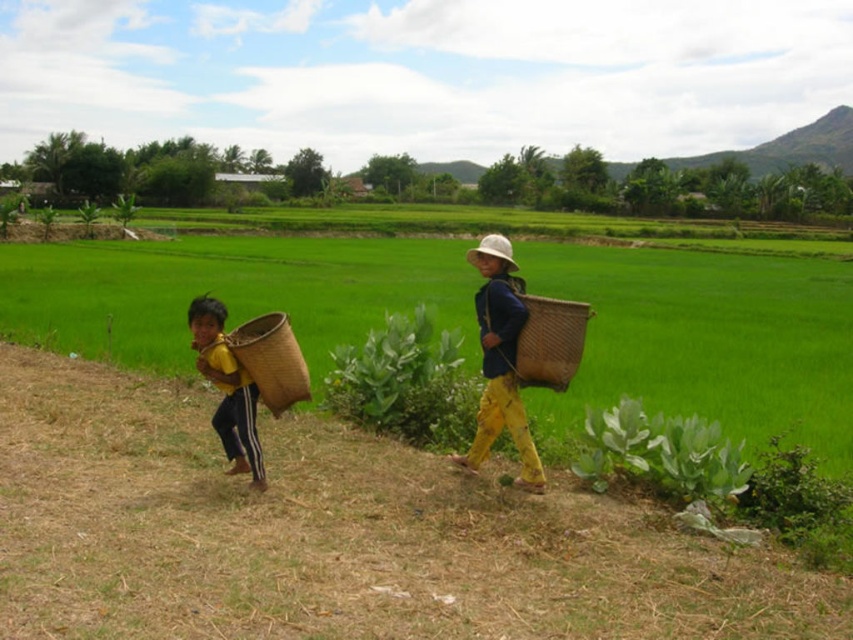
Between green leafy plant at center and yellow fabric basket at left, which one is positioned lower?

Positioned lower is green leafy plant at center.

Which is above, green leafy plant at center or yellow fabric basket at left?

Positioned higher is yellow fabric basket at left.

The image size is (853, 640). What do you see at coordinates (405, 381) in the screenshot?
I see `green leafy plant at center` at bounding box center [405, 381].

Locate an element on the screen. Image resolution: width=853 pixels, height=640 pixels. green leafy plant at center is located at coordinates (405, 381).

Can you confirm if matte wicker basket at right is smaller than woven brown basket at center?

No, matte wicker basket at right is not smaller than woven brown basket at center.

Does matte wicker basket at right have a greater height compared to woven brown basket at center?

Yes.

This screenshot has height=640, width=853. What do you see at coordinates (500, 362) in the screenshot? I see `matte wicker basket at right` at bounding box center [500, 362].

I want to click on matte wicker basket at right, so click(x=500, y=362).

Consider the image. Can you confirm if matte wicker basket at right is positioned to the right of yellow fabric basket at left?

Yes, matte wicker basket at right is to the right of yellow fabric basket at left.

Can you confirm if matte wicker basket at right is positioned to the left of yellow fabric basket at left?

In fact, matte wicker basket at right is to the right of yellow fabric basket at left.

Which is in front, point (482, 244) or point (212, 349)?

Point (212, 349)

In order to click on matte wicker basket at right in this screenshot , I will do `click(500, 362)`.